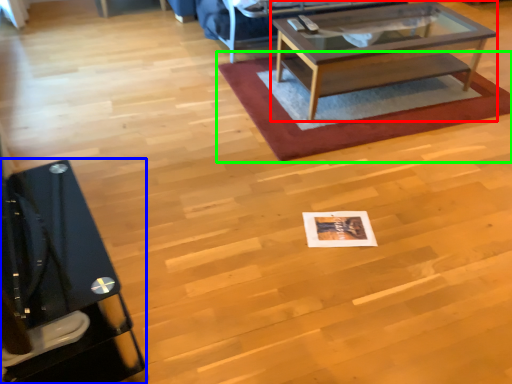
Question: Which object is positioned closest to coffee table (highlighted by a red box)? Select from desk (highlighted by a blue box) and mat (highlighted by a green box).

Choices:
 (A) desk
 (B) mat

Answer: (B)